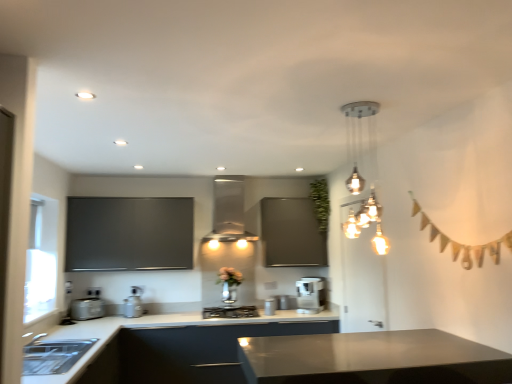
Where is `green leafy plant at upper center`? green leafy plant at upper center is located at coordinates (320, 202).

The image size is (512, 384). Find the location of `matte black board at upper left`. matte black board at upper left is located at coordinates (129, 233).

At what (x,y) coordinates should I click in order to perform the action: click on white plastic electric outlet at lower left. Please return your answer as a coordinate pair (x, y). The image size is (512, 384). Looking at the image, I should click on (93, 292).

Could you tell me if black matte gas stove at center is turned towards white plastic electric outlet at lower left?

No, black matte gas stove at center does not turn towards white plastic electric outlet at lower left.

Is black matte gas stove at center shorter than white plastic electric outlet at lower left?

Yes.

Is black matte gas stove at center bigger or smaller than white plastic electric outlet at lower left?

In the image, black matte gas stove at center appears to be larger than white plastic electric outlet at lower left.

Measure the distance between black matte gas stove at center and white plastic electric outlet at lower left.

1.37 meters.

In the scene shown: In the image, is black matte gas stove at center on the left side or the right side of matte silver exhaust hood at center?

In the image, black matte gas stove at center appears on the right side of matte silver exhaust hood at center.

Are black matte gas stove at center and matte silver exhaust hood at center located far from each other?

They are positioned close to each other.

Is black matte gas stove at center facing towards matte silver exhaust hood at center?

No, black matte gas stove at center is not facing towards matte silver exhaust hood at center.

From a real-world perspective, is black matte gas stove at center above or below matte silver exhaust hood at center?

In terms of real-world spatial position, black matte gas stove at center is below matte silver exhaust hood at center.

From a real-world perspective, is shiny metallic chandelier at upper right on top of satin silver coffee maker at center?

Indeed, from a real-world perspective, shiny metallic chandelier at upper right stands above satin silver coffee maker at center.

Which object is thinner, shiny metallic chandelier at upper right or satin silver coffee maker at center?

shiny metallic chandelier at upper right.

Is shiny metallic chandelier at upper right located outside satin silver coffee maker at center?

Yes, shiny metallic chandelier at upper right is located beyond the bounds of satin silver coffee maker at center.

Is shiny metallic chandelier at upper right oriented towards satin silver coffee maker at center?

No, shiny metallic chandelier at upper right is not turned towards satin silver coffee maker at center.

Considering the sizes of objects satin silver toaster at lower left, acting as the third appliance starting from the right, and satin silver coffee maker at center, the third appliance from the left, in the image provided, who is bigger, satin silver toaster at lower left, acting as the third appliance starting from the right, or satin silver coffee maker at center, the third appliance from the left,?

With larger size is satin silver toaster at lower left, acting as the third appliance starting from the right.

From a real-world perspective, does satin silver toaster at lower left, acting as the third appliance starting from the right, stand above satin silver coffee maker at center, the third appliance from the left?

Indeed, from a real-world perspective, satin silver toaster at lower left, acting as the third appliance starting from the right, stands above satin silver coffee maker at center, the third appliance from the left.

From the image's perspective, is satin silver toaster at lower left, which ranks as the 1th appliance in left-to-right order, beneath satin silver coffee maker at center, the 1th appliance positioned from the right?

Incorrect, from the image's perspective, satin silver toaster at lower left, which ranks as the 1th appliance in left-to-right order, is higher than satin silver coffee maker at center, the 1th appliance positioned from the right.

Is satin silver toaster at lower left, acting as the third appliance starting from the right, inside matte gray countertop at lower center?

Yes, matte gray countertop at lower center is surrounding satin silver toaster at lower left, acting as the third appliance starting from the right.

From the image's perspective, is matte gray countertop at lower center located above satin silver toaster at lower left, which ranks as the 1th appliance in left-to-right order?

No, from the image's perspective, matte gray countertop at lower center is not over satin silver toaster at lower left, which ranks as the 1th appliance in left-to-right order.

Between matte gray countertop at lower center and satin silver toaster at lower left, which ranks as the 1th appliance in left-to-right order, which one is positioned behind?

satin silver toaster at lower left, which ranks as the 1th appliance in left-to-right order, is more distant.

Can you confirm if satin silver coffee maker at center, the third appliance from the left, is thinner than satin black cabinet at lower left?

Correct, the width of satin silver coffee maker at center, the third appliance from the left, is less than that of satin black cabinet at lower left.

Which object is positioned more to the left, satin silver coffee maker at center, the 1th appliance positioned from the right, or satin black cabinet at lower left?

Positioned to the left is satin black cabinet at lower left.

Which is correct: satin silver coffee maker at center, the 1th appliance positioned from the right, is inside satin black cabinet at lower left, or outside of it?

satin silver coffee maker at center, the 1th appliance positioned from the right, is spatially positioned inside satin black cabinet at lower left.

From their relative heights in the image, would you say satin silver coffee maker at center, the third appliance from the left, is taller or shorter than satin black cabinet at lower left?

satin silver coffee maker at center, the third appliance from the left, is shorter than satin black cabinet at lower left.

Looking at their sizes, would you say matte black board at upper left is wider or thinner than satin silver toaster at lower left, which ranks as the 1th appliance in left-to-right order?

matte black board at upper left is wider than satin silver toaster at lower left, which ranks as the 1th appliance in left-to-right order.

Which object is further away from the camera, matte black board at upper left or satin silver toaster at lower left, which ranks as the 1th appliance in left-to-right order?

matte black board at upper left is more distant.

Would you say matte black board at upper left is outside satin silver toaster at lower left, acting as the third appliance starting from the right?

Absolutely, matte black board at upper left is external to satin silver toaster at lower left, acting as the third appliance starting from the right.

You are a GUI agent. You are given a task and a screenshot of the screen. Output one action in this format:
    pyautogui.click(x=<x>, y=<y>)
    Task: Click on the electric outlet above the black matte gas stove at center (from a real-world perspective)
    The height and width of the screenshot is (384, 512).
    Given the screenshot: What is the action you would take?
    pyautogui.click(x=93, y=292)

Where is `exhaust hood lying behind the black matte gas stove at center`? The width and height of the screenshot is (512, 384). exhaust hood lying behind the black matte gas stove at center is located at coordinates (229, 212).

Looking at the image, which one is located further to black matte gas stove at center, satin silver coffee maker at center, the 1th appliance positioned from the right, or matte silver exhaust hood at center?

The object further to black matte gas stove at center is matte silver exhaust hood at center.

From the image, which object appears to be nearer to matte gray countertop at lower center, matte black board at upper left or satin black cabinet at lower left?

Based on the image, satin black cabinet at lower left appears to be nearer to matte gray countertop at lower center.

Based on the photo, looking at the image, which one is located closer to satin silver coffee maker at center, matte gray countertop at lower center or black matte gas stove at center?

black matte gas stove at center is positioned closer to the anchor satin silver coffee maker at center.

Looking at the image, which one is located further to satin silver coffee maker at center, satin black cabinet at lower left or satin silver coffee maker at center, the 1th appliance positioned from the right?

Based on the image, satin black cabinet at lower left appears to be further to satin silver coffee maker at center.

From the image, which object appears to be nearer to satin black cabinet at lower left, matte black board at upper left or matte silver exhaust hood at center?

matte black board at upper left is positioned closer to the anchor satin black cabinet at lower left.

Which object lies nearer to the anchor point green leafy plant at upper center, shiny metallic chandelier at upper right or satin black cabinet at lower left?

shiny metallic chandelier at upper right lies closer to green leafy plant at upper center than the other object.

Which object lies further to the anchor point matte gray countertop at lower center, satin silver toaster at lower left, which ranks as the 1th appliance in left-to-right order, or matte silver exhaust hood at center?

The object further to matte gray countertop at lower center is matte silver exhaust hood at center.

Which object lies further to the anchor point satin black cabinet at lower left, matte silver exhaust hood at center or satin silver toaster at lower left, acting as the third appliance starting from the right?

The object further to satin black cabinet at lower left is matte silver exhaust hood at center.

Locate an element on the screen. exhaust hood between shiny metallic chandelier at upper right and green leafy plant at upper center from front to back is located at coordinates (229, 212).

The image size is (512, 384). I want to click on gas stove between matte silver exhaust hood at center and satin black cabinet at lower left from top to bottom, so click(x=230, y=312).

The width and height of the screenshot is (512, 384). I want to click on gas stove between satin silver toaster at lower left, which ranks as the 1th appliance in left-to-right order, and green leafy plant at upper center, so click(x=230, y=312).

The height and width of the screenshot is (384, 512). Find the location of `bulletin board between satin silver toaster at lower left, acting as the third appliance starting from the right, and green leafy plant at upper center, in the horizontal direction`. bulletin board between satin silver toaster at lower left, acting as the third appliance starting from the right, and green leafy plant at upper center, in the horizontal direction is located at coordinates (129, 233).